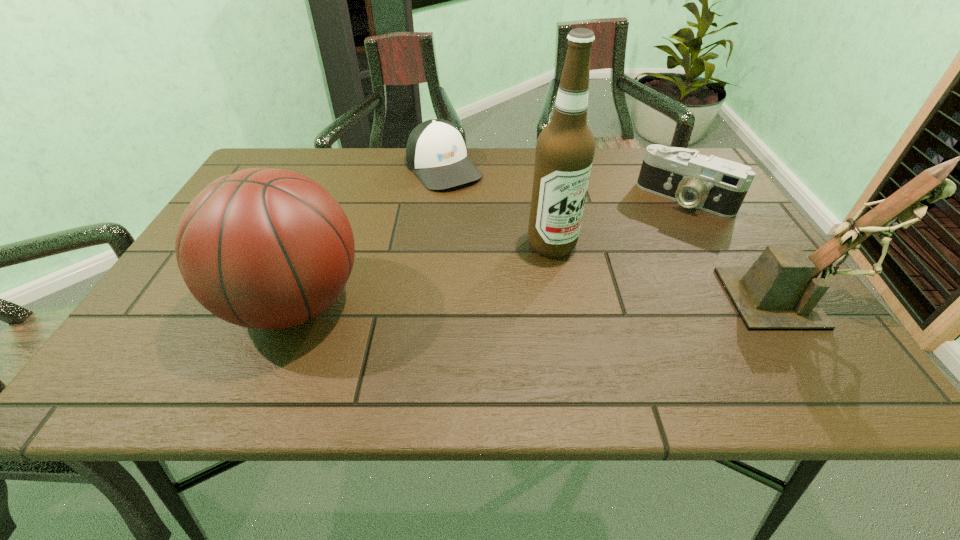
Where is `empty space that is in between the basketball and the third object from right to left`? The image size is (960, 540). empty space that is in between the basketball and the third object from right to left is located at coordinates (423, 274).

Image resolution: width=960 pixels, height=540 pixels. In order to click on blank region between the alcohol and the leftmost object in this screenshot , I will do `click(423, 274)`.

Identify the location of free space between the figurine and the camera. The width and height of the screenshot is (960, 540). (740, 248).

Locate an element on the screen. Image resolution: width=960 pixels, height=540 pixels. empty space that is in between the basketball and the fourth object from right to left is located at coordinates pos(369,235).

You are a GUI agent. You are given a task and a screenshot of the screen. Output one action in this format:
    pyautogui.click(x=<x>, y=<y>)
    Task: Click on the free space that is in between the basketball and the camera
    
    Given the screenshot: What is the action you would take?
    pyautogui.click(x=490, y=251)

In order to click on unoccupied position between the cap and the leftmost object in this screenshot , I will do `click(369, 235)`.

Where is `vacant space that is in between the alcohol and the figurine`? The image size is (960, 540). vacant space that is in between the alcohol and the figurine is located at coordinates (673, 272).

This screenshot has width=960, height=540. In order to click on free space that is in between the figurine and the camera in this screenshot , I will do `click(740, 248)`.

Identify which object is located as the nearest to the camera. Please provide its 2D coordinates. Your answer should be formatted as a tuple, i.e. [(x, y)], where the tuple contains the x and y coordinates of a point satisfying the conditions above.

[(781, 290)]

Where is `object that is the fourth nearest to the camera`? This screenshot has height=540, width=960. object that is the fourth nearest to the camera is located at coordinates (264, 248).